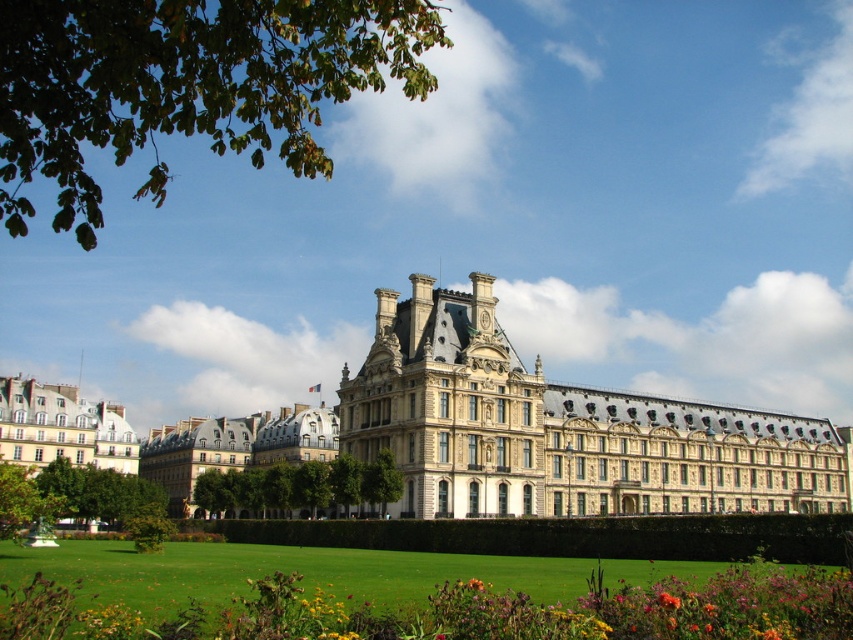
You are a photographer planning to capture the beige stone building at center and the yellow matte flower at lower center in a single frame. Based on their sizes, which object should you focus on to ensure both are clearly visible in the photo?

The beige stone building at center is larger than the yellow matte flower at lower center, so focusing on the beige stone building at center would ensure both are clearly visible in the photo since it occupies more space in the frame.

You are standing in front of the grand building and notice a green leafy tree nearby. Based on the scene, can you tell me which object is positioned more to the left between the white stone building at lower left and the green leafy tree at lower left?

The white stone building at lower left is positioned to the left of the green leafy tree at lower left, so the white stone building at lower left is more to the left.

You are an architect evaluating the proportions of the beige stone building at center and the yellow matte flower at lower center in the image. Which object has a greater width?

The beige stone building at center has a greater width than the yellow matte flower at lower center.